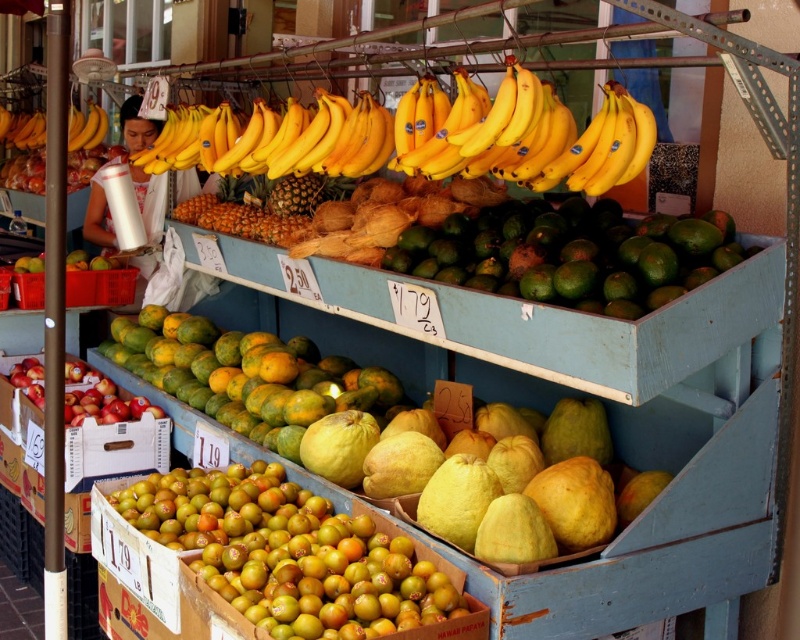
Question: Is green matte mangoes at center closer to camera compared to green matte papaya at center?

Choices:
 (A) no
 (B) yes

Answer: (B)

Question: Which of these objects is positioned closest to the green matte mangoes at center?

Choices:
 (A) yellow matte quince at center
 (B) yellow matte bananas at upper center
 (C) green matte papaya at center

Answer: (A)

Question: Is green matte plum at lower left bigger than green matte mangoes at center?

Choices:
 (A) yes
 (B) no

Answer: (B)

Question: From the image, what is the correct spatial relationship of green matte papaya at center in relation to yellow matte bananas at upper center?

Choices:
 (A) right
 (B) left

Answer: (A)

Question: Which point appears farthest from the camera in this image?

Choices:
 (A) (498, 497)
 (B) (280, 620)
 (C) (104, 132)
 (D) (97, 376)

Answer: (C)

Question: Which point is closer to the camera?

Choices:
 (A) yellow matte quince at center
 (B) green matte papaya at center
 (C) green matte plum at lower left

Answer: (C)